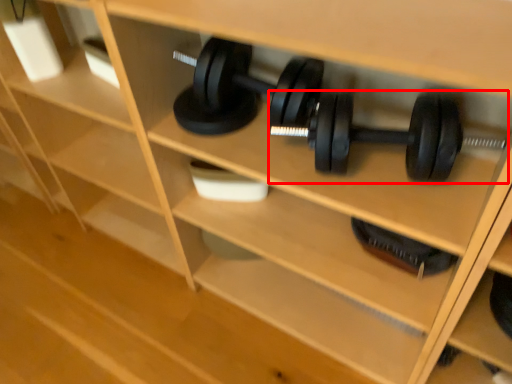
Question: From the image's perspective, what is the correct spatial relationship of dumbbell (annotated by the red box) in relation to dumbbell?

Choices:
 (A) below
 (B) above

Answer: (B)